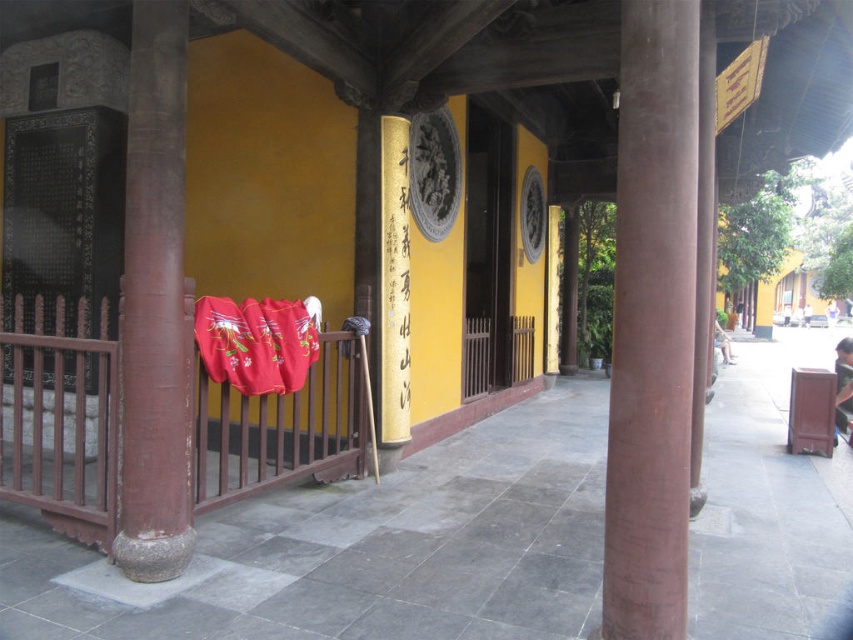
You are an architect visiting this traditional East Asian building. You notice the brown wooden door at center and the gold paper scroll at center. Which object is taller?

The brown wooden door at center is much taller than the gold paper scroll at center.

You are a visitor standing at the entrance of the temple and see the smooth wooden rail at center left and the red cloth with floral patterns hanging on it. You want to place a small offering on the floor between them. How far apart are the two objects?

The smooth wooden rail at center left and the red cloth with floral patterns hanging on it are 4.21 meters apart.